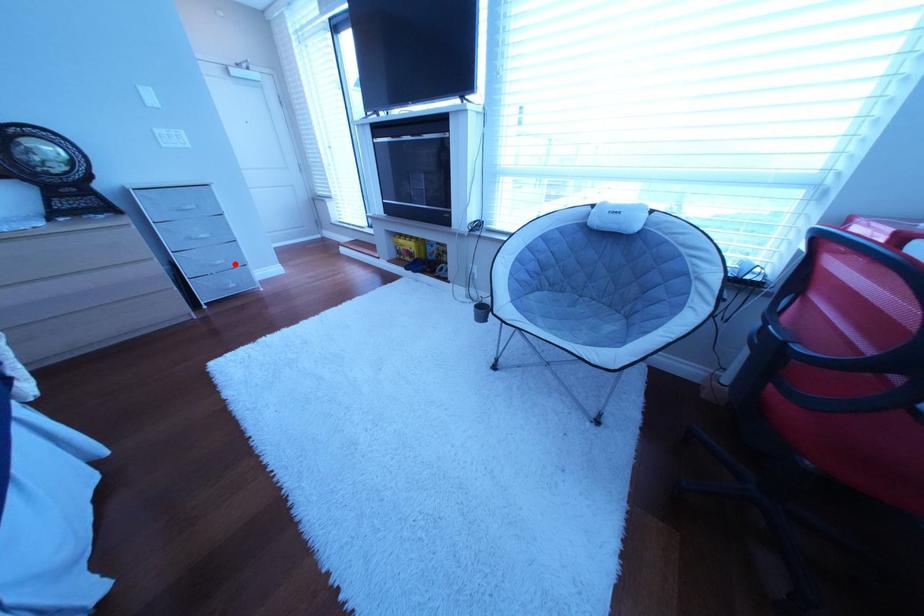
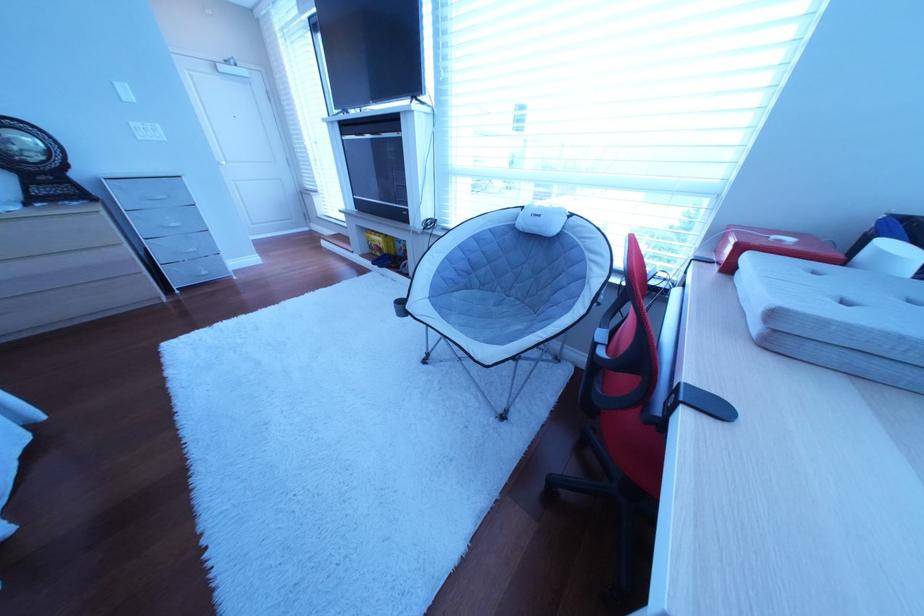
Where in the second image is the point corresponding to the highlighted location from the first image?

(207, 252)